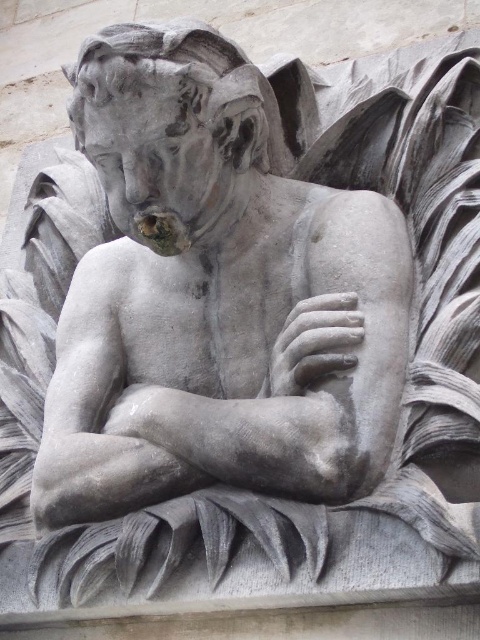
Question: Observing the image, what is the correct spatial positioning of gray stone statue at center in reference to gray stone hand at center?

Choices:
 (A) right
 (B) left

Answer: (B)

Question: Which point is farther to the camera?

Choices:
 (A) gray stone hand at center
 (B) gray stone statue at center

Answer: (A)

Question: Does gray stone statue at center appear under gray stone hand at center?

Choices:
 (A) no
 (B) yes

Answer: (A)

Question: Which point is closer to the camera?

Choices:
 (A) gray stone hand at center
 (B) gray stone statue at center

Answer: (B)

Question: Can you confirm if gray stone statue at center is wider than gray stone hand at center?

Choices:
 (A) yes
 (B) no

Answer: (A)